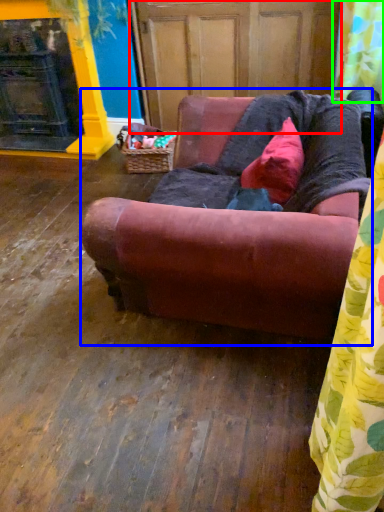
Question: Which object is positioned closest to screen door (highlighted by a red box)? Select from studio couch (highlighted by a blue box) and shower curtain (highlighted by a green box).

Choices:
 (A) studio couch
 (B) shower curtain

Answer: (B)